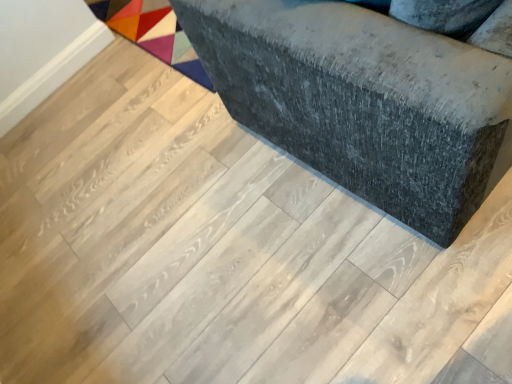
Question: Can you confirm if dark gray fabric ottoman at center is thinner than multicolored fabric mat at upper left?

Choices:
 (A) yes
 (B) no

Answer: (A)

Question: Is the position of dark gray fabric ottoman at center more distant than that of multicolored fabric mat at upper left?

Choices:
 (A) no
 (B) yes

Answer: (A)

Question: Does dark gray fabric ottoman at center come in front of multicolored fabric mat at upper left?

Choices:
 (A) no
 (B) yes

Answer: (B)

Question: Can you see dark gray fabric ottoman at center touching multicolored fabric mat at upper left?

Choices:
 (A) yes
 (B) no

Answer: (B)

Question: Is dark gray fabric ottoman at center looking in the opposite direction of multicolored fabric mat at upper left?

Choices:
 (A) yes
 (B) no

Answer: (B)

Question: From a real-world perspective, is dark gray fabric ottoman at center on top of multicolored fabric mat at upper left?

Choices:
 (A) no
 (B) yes

Answer: (B)

Question: Is multicolored fabric mat at upper left completely or partially outside of dark gray fabric ottoman at center?

Choices:
 (A) no
 (B) yes

Answer: (B)

Question: Can you confirm if multicolored fabric mat at upper left is taller than dark gray fabric ottoman at center?

Choices:
 (A) no
 (B) yes

Answer: (A)

Question: Does multicolored fabric mat at upper left have a smaller size compared to dark gray fabric ottoman at center?

Choices:
 (A) no
 (B) yes

Answer: (B)

Question: Can dark gray fabric ottoman at center be found inside multicolored fabric mat at upper left?

Choices:
 (A) no
 (B) yes

Answer: (A)

Question: Is multicolored fabric mat at upper left positioned with its back to dark gray fabric ottoman at center?

Choices:
 (A) no
 (B) yes

Answer: (A)

Question: From the image's perspective, is multicolored fabric mat at upper left beneath dark gray fabric ottoman at center?

Choices:
 (A) no
 (B) yes

Answer: (A)

Question: Is dark gray fabric ottoman at center wider or thinner than multicolored fabric mat at upper left?

Choices:
 (A) wide
 (B) thin

Answer: (B)